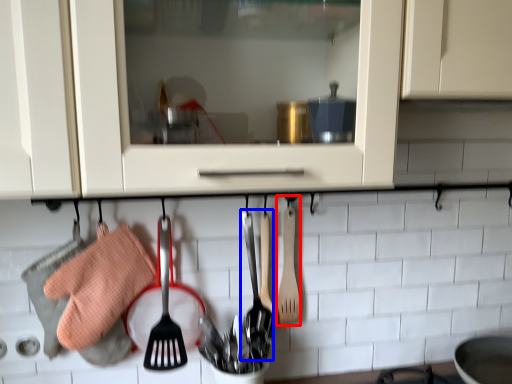
Question: Among these objects, which one is nearest to the camera, spatula (highlighted by a red box) or silverware (highlighted by a blue box)?

Choices:
 (A) spatula
 (B) silverware

Answer: (B)